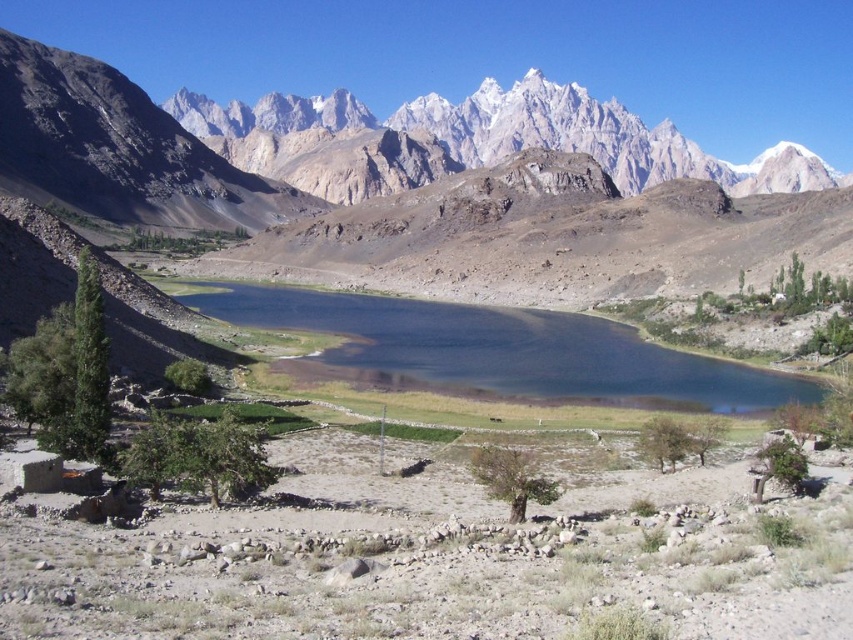
Does white rocky mountain range at upper center have a lesser height compared to shiny blue water at center?

In fact, white rocky mountain range at upper center may be taller than shiny blue water at center.

Who is lower down, white rocky mountain range at upper center or shiny blue water at center?

Positioned lower is shiny blue water at center.

The height and width of the screenshot is (640, 853). Find the location of `white rocky mountain range at upper center`. white rocky mountain range at upper center is located at coordinates (318, 145).

Locate an element on the screen. The height and width of the screenshot is (640, 853). white rocky mountain range at upper center is located at coordinates (318, 145).